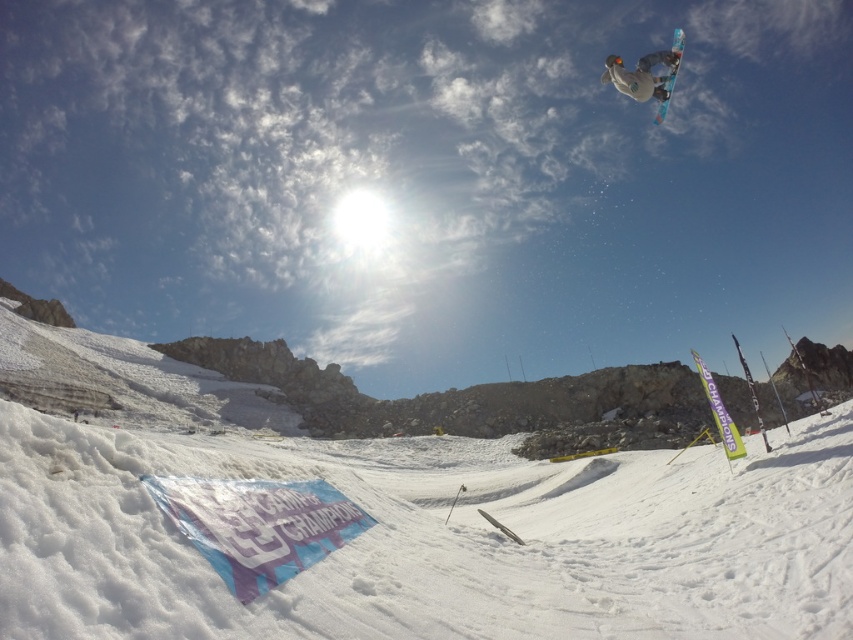
Question: In this image, where is white fluffy snow at lower center located relative to white matte snowboarder at upper right?

Choices:
 (A) above
 (B) below

Answer: (B)

Question: Is white fluffy snow at lower center positioned in front of blue glossy snowboard at upper right?

Choices:
 (A) no
 (B) yes

Answer: (B)

Question: Which of these objects is positioned closest to the white fluffy snow at lower center?

Choices:
 (A) white matte snowboarder at upper right
 (B) blue glossy snowboard at upper right

Answer: (A)

Question: Which point is closer to the camera taking this photo?

Choices:
 (A) pyautogui.click(x=606, y=56)
 (B) pyautogui.click(x=665, y=97)

Answer: (B)

Question: Can you confirm if white fluffy snow at lower center is thinner than blue glossy snowboard at upper right?

Choices:
 (A) yes
 (B) no

Answer: (A)

Question: Which point is farther from the camera taking this photo?

Choices:
 (A) (558, 472)
 (B) (675, 51)

Answer: (A)